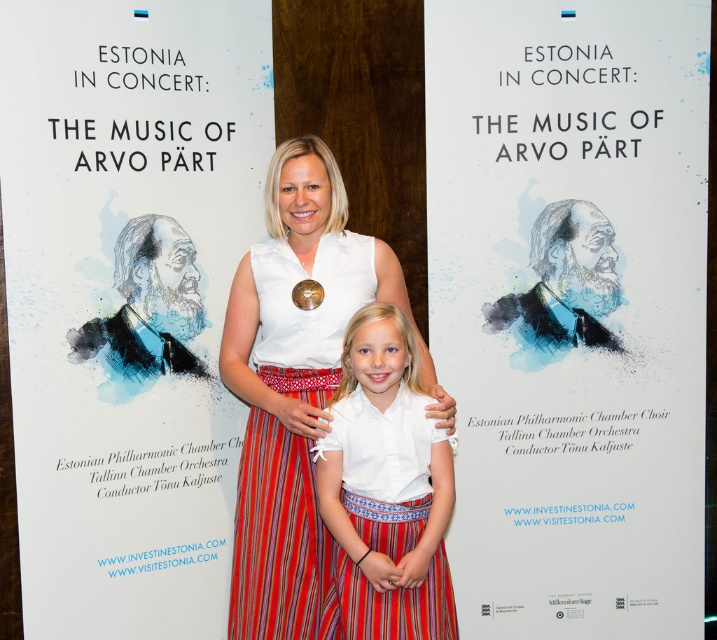
Question: Which point is closer to the camera?

Choices:
 (A) (647, 221)
 (B) (369, 307)
 (C) (4, 28)

Answer: (C)

Question: Observing the image, what is the correct spatial positioning of blue watercolor portrait at center in reference to white paper at center?

Choices:
 (A) left
 (B) right

Answer: (B)

Question: In this image, where is blue watercolor portrait at center located relative to white cotton blouse at center?

Choices:
 (A) right
 (B) left

Answer: (A)

Question: Which object is positioned farthest from the blue watercolor portrait at center?

Choices:
 (A) white paper at center
 (B) white cotton blouse at center

Answer: (A)

Question: Does blue watercolor portrait at center appear over white cotton shirt at center?

Choices:
 (A) yes
 (B) no

Answer: (A)

Question: Which of the following is the farthest from the observer?

Choices:
 (A) blue watercolor portrait at center
 (B) white paper at center

Answer: (A)